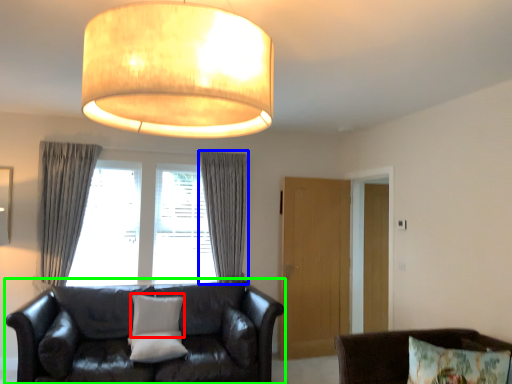
Question: Based on their relative distances, which object is farther from pillow (highlighted by a red box)? Choose from curtain (highlighted by a blue box) and studio couch (highlighted by a green box).

Choices:
 (A) curtain
 (B) studio couch

Answer: (A)